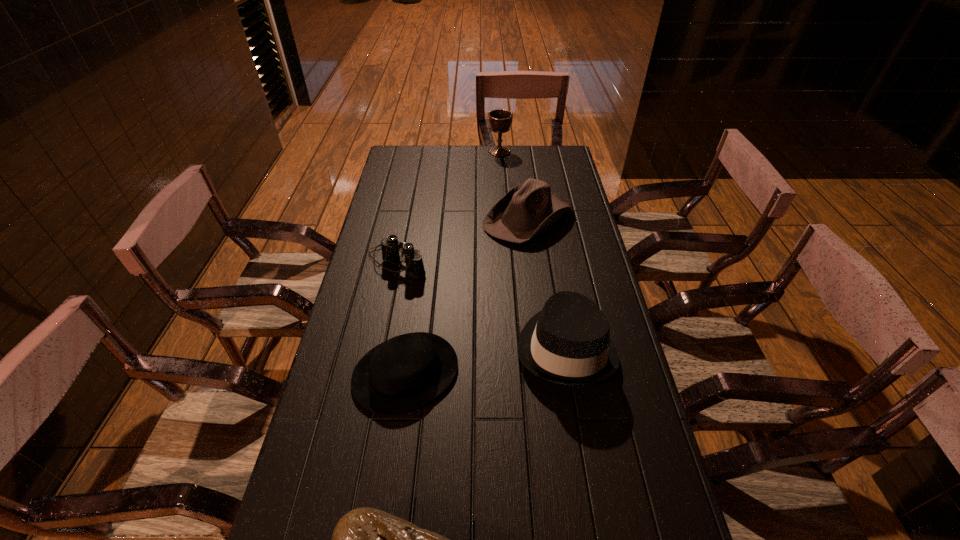
Where is `free space between the binoculars and the leftmost fedora`? free space between the binoculars and the leftmost fedora is located at coordinates (401, 318).

Locate an element on the screen. empty space between the farthest fedora and the shortest fedora is located at coordinates (467, 295).

Identify which object is the second closest to the shortest fedora. Please provide its 2D coordinates. Your answer should be formatted as a tuple, i.e. [(x, y)], where the tuple contains the x and y coordinates of a point satisfying the conditions above.

[(390, 253)]

Where is `object that can be found as the fourth closest to the farthest fedora`? The width and height of the screenshot is (960, 540). object that can be found as the fourth closest to the farthest fedora is located at coordinates (403, 373).

Locate which fedora ranks in proximity to the leftmost fedora. Please provide its 2D coordinates. Your answer should be formatted as a tuple, i.e. [(x, y)], where the tuple contains the x and y coordinates of a point satisfying the conditions above.

[(568, 342)]

Find the location of `fedora that stands as the third closest to the nearest object`. fedora that stands as the third closest to the nearest object is located at coordinates (525, 211).

Locate an element on the screen. free spot that satisfies the following two spatial constraints: 1. on the front side of the third shortest object; 2. on the right side of the leftmost fedora is located at coordinates (375, 373).

The image size is (960, 540). Identify the location of free location that satisfies the following two spatial constraints: 1. on the front side of the second tallest fedora; 2. on the left side of the tallest fedora. click(x=544, y=347).